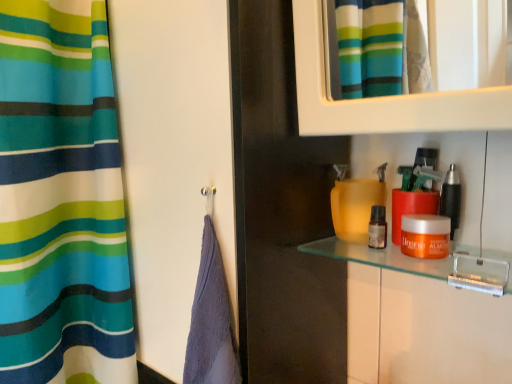
Question: From the image's perspective, relative to transparent glass screen door at center, is metallic black razor at right, the first cosmetic viewed from the right, above or below?

Choices:
 (A) below
 (B) above

Answer: (B)

Question: Which is correct: metallic black razor at right, the 3th cosmetic in the left-to-right sequence, is inside transparent glass screen door at center, or outside of it?

Choices:
 (A) outside
 (B) inside

Answer: (A)

Question: Which object is positioned farthest from the metallic black razor at right, the 3th cosmetic in the left-to-right sequence?

Choices:
 (A) orange matte jar at right, which ranks as the 2th cosmetic in left-to-right order
 (B) transparent glass screen door at center
 (C) translucent glass shelf at center
 (D) translucent amber bottle at center, the 3th cosmetic in the right-to-left sequence

Answer: (B)

Question: Considering the real-world distances, which object is closest to the translucent amber bottle at center, the 3th cosmetic in the right-to-left sequence?

Choices:
 (A) metallic black razor at right, the 3th cosmetic in the left-to-right sequence
 (B) orange matte jar at right, which ranks as the 2th cosmetic in left-to-right order
 (C) translucent glass shelf at center
 (D) transparent glass screen door at center

Answer: (B)